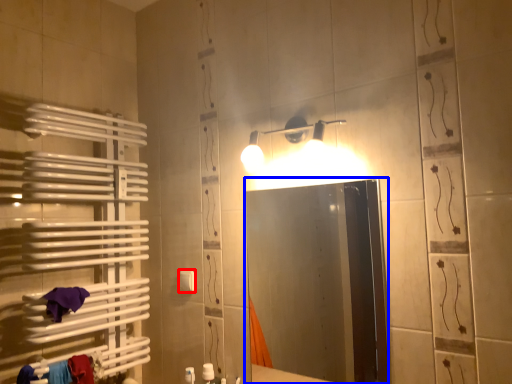
Question: Which object appears closest to the camera in this image, towel bar (highlighted by a red box) or mirror (highlighted by a blue box)?

Choices:
 (A) towel bar
 (B) mirror

Answer: (B)